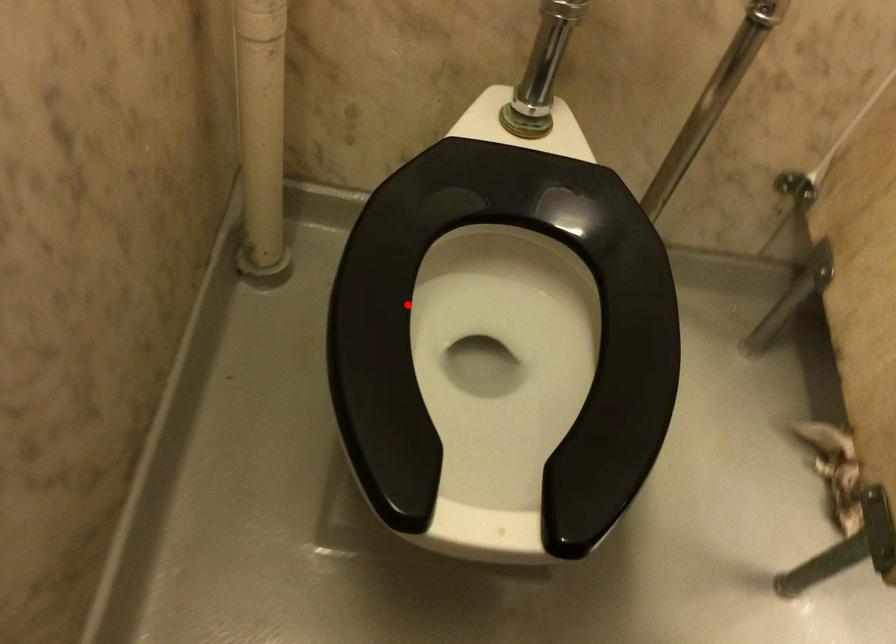
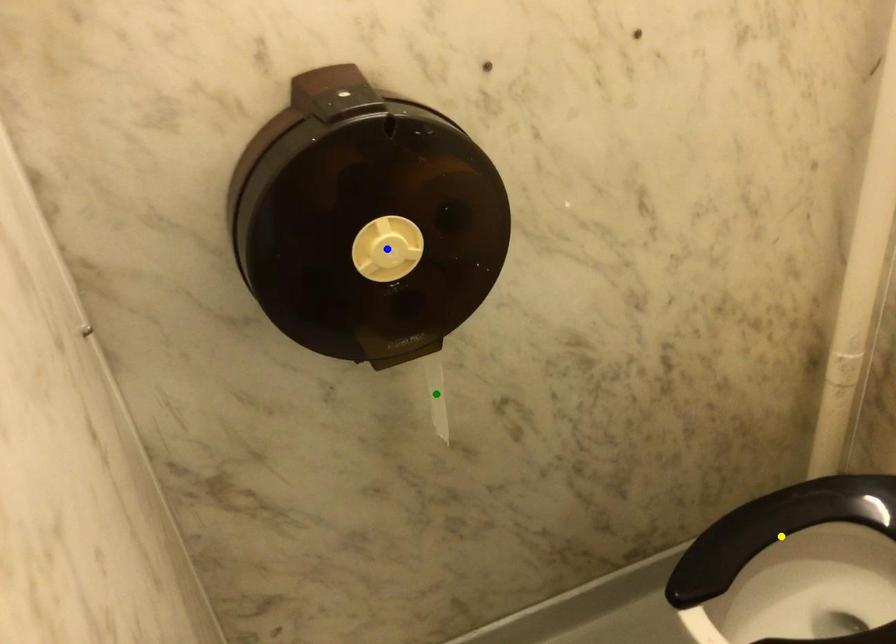
Question: I am providing you with two images of the same scene from different viewpoints. A red point is marked on the first image. You are given multiple points on the second image. Which point in image 2 is actually the same real-world point as the red point in image 1?

Choices:
 (A) blue point
 (B) yellow point
 (C) green point

Answer: (B)